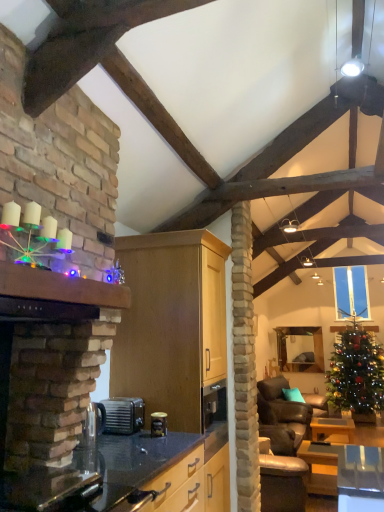
The width and height of the screenshot is (384, 512). In order to click on vacant region in front of metallic black toaster at center, marked as the 3th appliance in a front-to-back arrangement in this screenshot , I will do `click(127, 438)`.